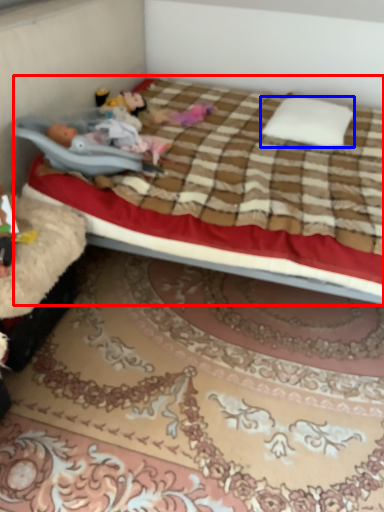
Question: Which object appears farthest to the camera in this image, bed (highlighted by a red box) or pillow (highlighted by a blue box)?

Choices:
 (A) bed
 (B) pillow

Answer: (B)